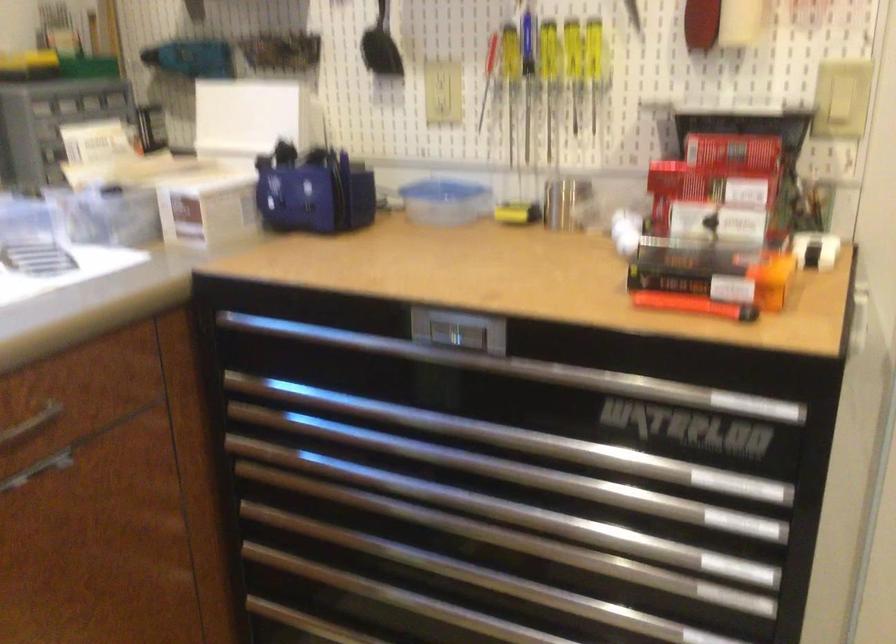
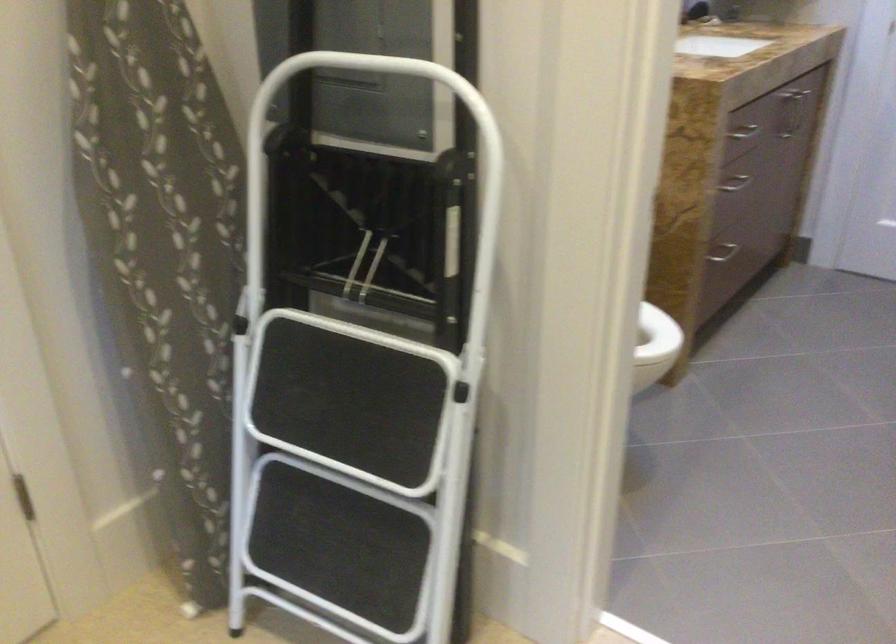
First-person continuous shooting, in which direction is the camera rotating?

The camera rotated toward right-down.